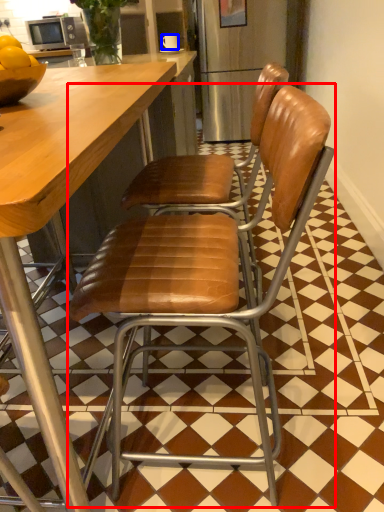
Question: Which of the following is the closest to the observer, chair (highlighted by a red box) or coffee cup (highlighted by a blue box)?

Choices:
 (A) chair
 (B) coffee cup

Answer: (A)